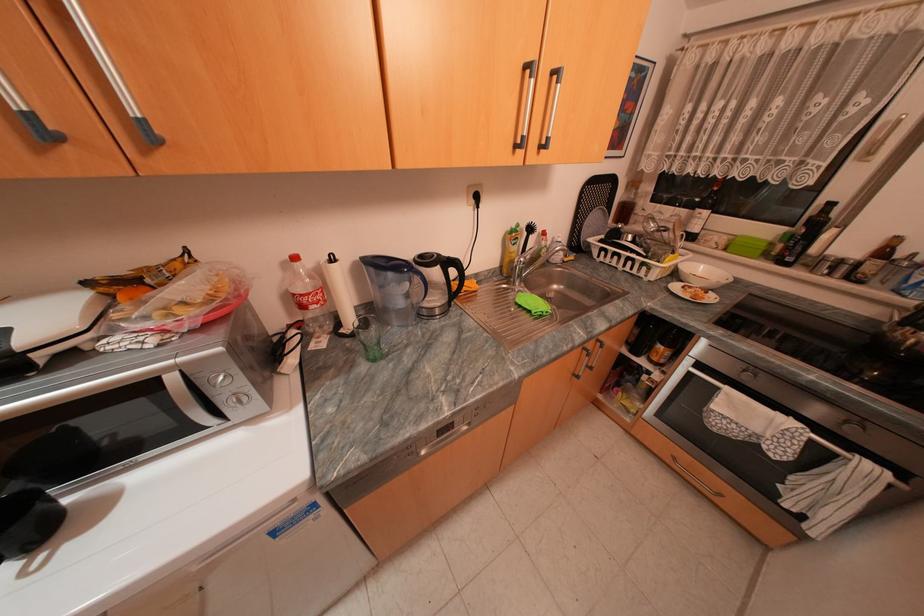
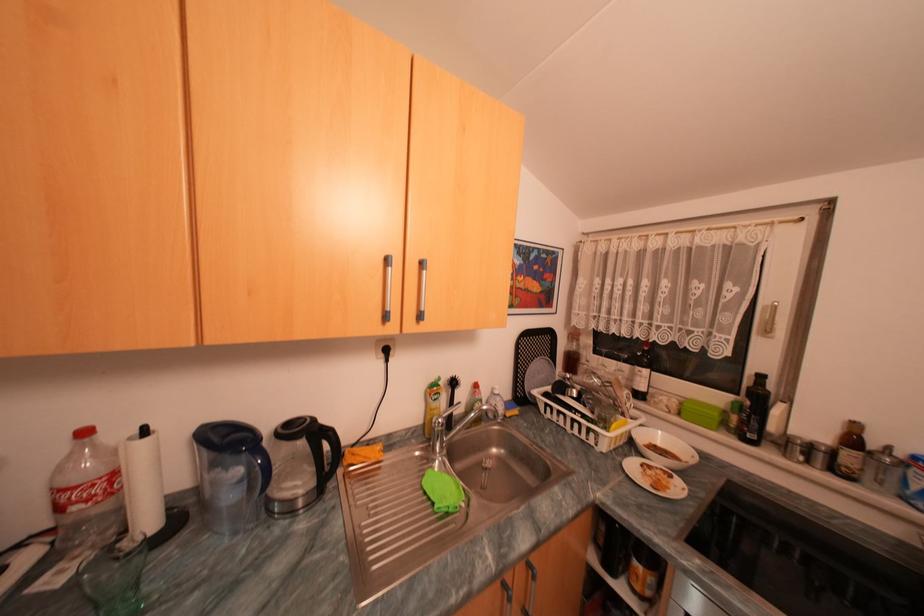
Find the pixel in the second image that matches point (411, 272) in the first image.

(249, 451)